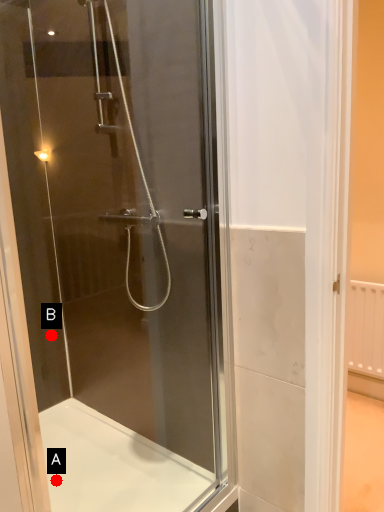
Question: Two points are circled on the image, labeled by A and B beside each circle. Which point is closer to the camera?

Choices:
 (A) A is closer
 (B) B is closer

Answer: (A)